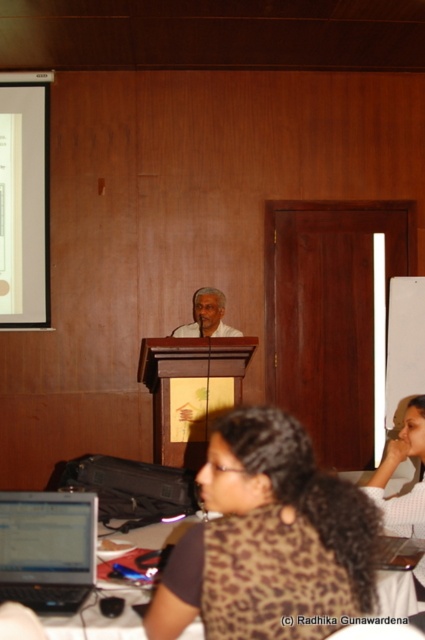
This screenshot has height=640, width=425. Describe the element at coordinates (23, 198) in the screenshot. I see `white matte projection screen at upper left` at that location.

Does white matte projection screen at upper left lie behind brown leopard print shirt at lower right?

Yes, it is.

The image size is (425, 640). Describe the element at coordinates (23, 198) in the screenshot. I see `white matte projection screen at upper left` at that location.

Locate an element on the screen. This screenshot has height=640, width=425. white matte projection screen at upper left is located at coordinates (23, 198).

Between brown leopard print shirt at lower center and white matte projection screen at upper left, which one has more height?

white matte projection screen at upper left is taller.

The image size is (425, 640). Describe the element at coordinates (268, 536) in the screenshot. I see `brown leopard print shirt at lower center` at that location.

The image size is (425, 640). Identify the location of brown leopard print shirt at lower center. (268, 536).

Does silver metallic laptop at lower left come behind white matte speaker at center?

That is False.

Is silver metallic laptop at lower left thinner than white matte speaker at center?

Yes, silver metallic laptop at lower left is thinner than white matte speaker at center.

Which is behind, point (53, 554) or point (223, 310)?

Point (223, 310)

The width and height of the screenshot is (425, 640). Find the location of `silver metallic laptop at lower left`. silver metallic laptop at lower left is located at coordinates (47, 548).